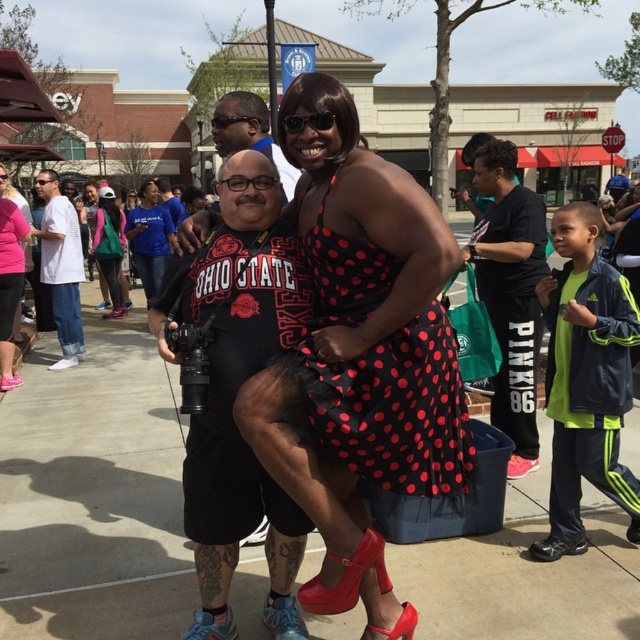
In the scene shown: You are a photographer at the event and need to capture a clear shot of both the pink matte dress at center and the brushed metal shoe at center. Based on their positions, which object is closer to the camera?

The pink matte dress at center is above the brushed metal shoe at center, so the pink matte dress at center is closer to the camera.

You are organizing a shoe display at a store and need to arrange the blue fabric shoe at lower left and the shiny black shoe at center based on their widths. Which shoe should be placed on the wider side of the display rack?

The blue fabric shoe at lower left should be placed on the wider side of the display rack since its width is larger than the shiny black shoe at center.

You are a photographer at the event and need to capture a clear shot of the shiny black shoe at center without the blue fabric shoe at lower left blocking it. How can you adjust your position to achieve this?

Move your camera position backward so that the blue fabric shoe at lower left is no longer in front of the shiny black shoe at center.